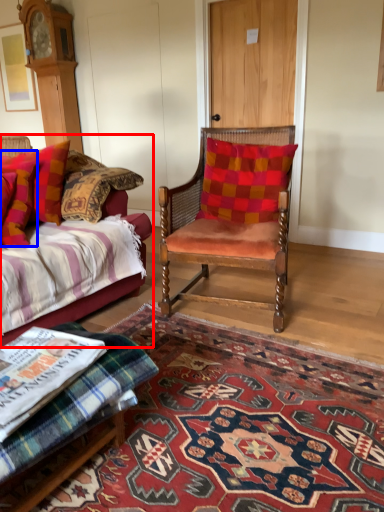
Question: Which of the following is the farthest to the observer, studio couch (highlighted by a red box) or pillow (highlighted by a blue box)?

Choices:
 (A) studio couch
 (B) pillow

Answer: (B)